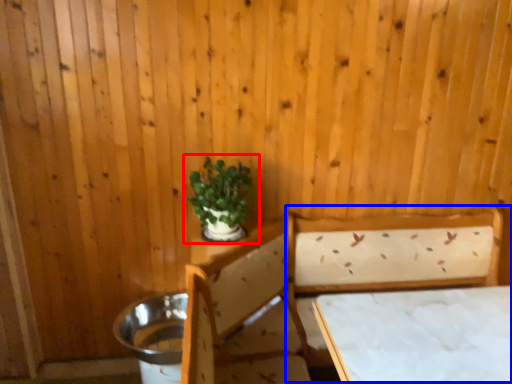
Question: Which point is closer to the camera, houseplant (highlighted by a red box) or bed (highlighted by a blue box)?

Choices:
 (A) houseplant
 (B) bed

Answer: (B)